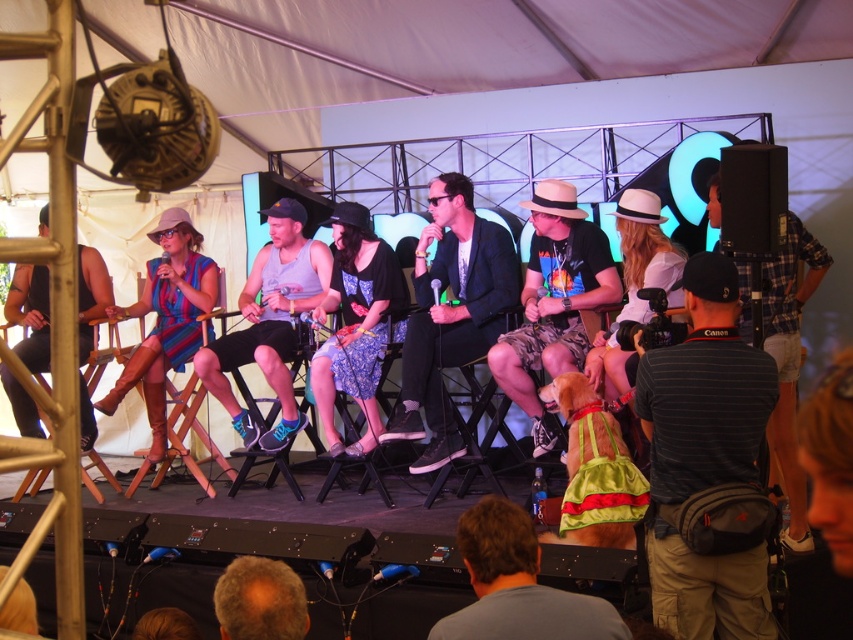
You are a photographer at the event and need to capture a closeup of the brown hair at lower center. What are the coordinates where you should focus your camera?

The coordinates for the brown hair at lower center are at point (517, 586).